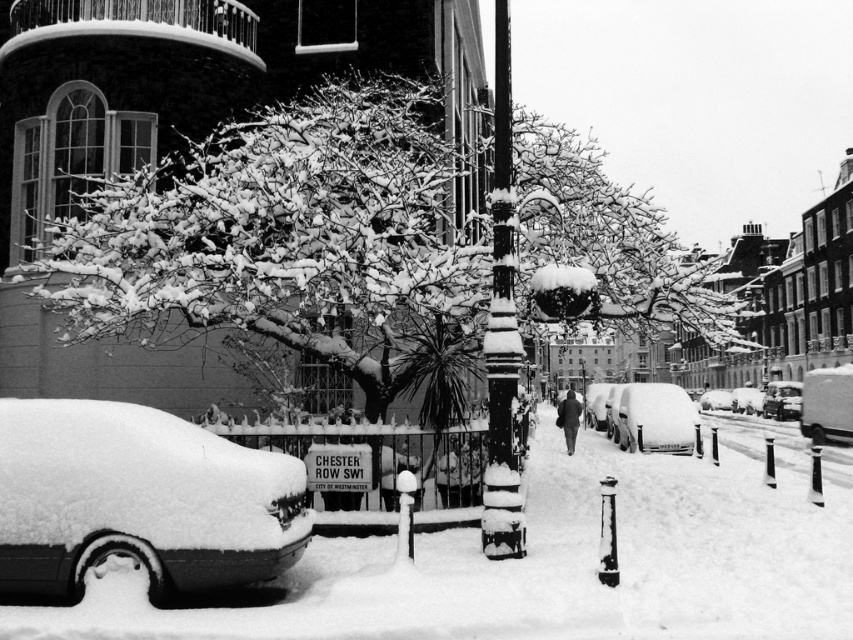
Where is `snow-covered branches at center`? This screenshot has width=853, height=640. snow-covered branches at center is located at coordinates (296, 243).

Between point (300, 204) and point (772, 394), which one is positioned in front?

Point (300, 204)

Find the location of a particular element. This screenshot has width=853, height=640. snow-covered branches at center is located at coordinates pyautogui.click(x=296, y=243).

Is snow-covered metal pole at center taller than metallic silver van at center?

Indeed, snow-covered metal pole at center has a greater height compared to metallic silver van at center.

Can you confirm if snow-covered metal pole at center is thinner than metallic silver van at center?

Correct, snow-covered metal pole at center's width is less than metallic silver van at center's.

Which is in front, point (509, 164) or point (740, 396)?

Point (509, 164)

Where is `snow-covered metal pole at center`? The width and height of the screenshot is (853, 640). snow-covered metal pole at center is located at coordinates (502, 326).

Which of these two, snow-covered metal pole at center or shiny silver car at center, stands taller?

snow-covered metal pole at center

Can you confirm if snow-covered metal pole at center is wider than shiny silver car at center?

No.

What do you see at coordinates (502, 326) in the screenshot? This screenshot has width=853, height=640. I see `snow-covered metal pole at center` at bounding box center [502, 326].

Locate an element on the screen. Image resolution: width=853 pixels, height=640 pixels. snow-covered metal pole at center is located at coordinates (502, 326).